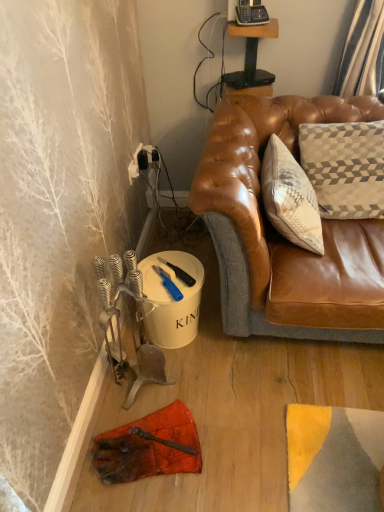
Question: Can you confirm if wooden table at upper center is positioned to the left of blue plastic knife at lower center, arranged as the 2th tool when ordered from the bottom?

Choices:
 (A) no
 (B) yes

Answer: (A)

Question: Is wooden table at upper center facing away from blue plastic knife at lower center, arranged as the 2th tool when ordered from the bottom?

Choices:
 (A) no
 (B) yes

Answer: (A)

Question: Is wooden table at upper center wider than blue plastic knife at lower center, the first tool from the top?

Choices:
 (A) yes
 (B) no

Answer: (B)

Question: From the image's perspective, does wooden table at upper center appear lower than blue plastic knife at lower center, the first tool from the top?

Choices:
 (A) yes
 (B) no

Answer: (B)

Question: Considering the relative positions of wooden table at upper center and blue plastic knife at lower center, arranged as the 2th tool when ordered from the bottom, in the image provided, is wooden table at upper center to the right of blue plastic knife at lower center, arranged as the 2th tool when ordered from the bottom, from the viewer's perspective?

Choices:
 (A) no
 (B) yes

Answer: (B)

Question: Does wooden table at upper center come behind blue plastic knife at lower center, arranged as the 2th tool when ordered from the bottom?

Choices:
 (A) yes
 (B) no

Answer: (A)

Question: From the image's perspective, is wooden table at upper center under blue plastic utility knife at lower center, the 2th tool when ordered from top to bottom?

Choices:
 (A) yes
 (B) no

Answer: (B)

Question: Considering the relative sizes of wooden table at upper center and blue plastic utility knife at lower center, the 2th tool when ordered from top to bottom, in the image provided, is wooden table at upper center smaller than blue plastic utility knife at lower center, the 2th tool when ordered from top to bottom,?

Choices:
 (A) yes
 (B) no

Answer: (B)

Question: From the image's perspective, is wooden table at upper center located above blue plastic utility knife at lower center, the first tool when ordered from bottom to top?

Choices:
 (A) yes
 (B) no

Answer: (A)

Question: Is wooden table at upper center not close to blue plastic utility knife at lower center, the first tool when ordered from bottom to top?

Choices:
 (A) no
 (B) yes

Answer: (A)

Question: Is wooden table at upper center looking in the opposite direction of blue plastic utility knife at lower center, the first tool when ordered from bottom to top?

Choices:
 (A) yes
 (B) no

Answer: (B)

Question: Does wooden table at upper center contain blue plastic utility knife at lower center, the 2th tool when ordered from top to bottom?

Choices:
 (A) no
 (B) yes

Answer: (A)

Question: Is wooden table at upper center at the back of blue plastic knife at lower center, arranged as the 2th tool when ordered from the bottom?

Choices:
 (A) no
 (B) yes

Answer: (A)